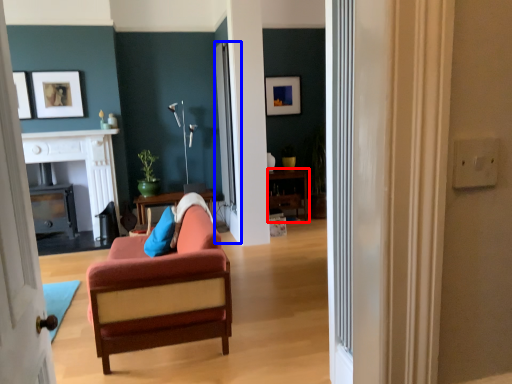
Question: Which point is closer to the camera, table (highlighted by a red box) or glass door (highlighted by a blue box)?

Choices:
 (A) table
 (B) glass door

Answer: (B)